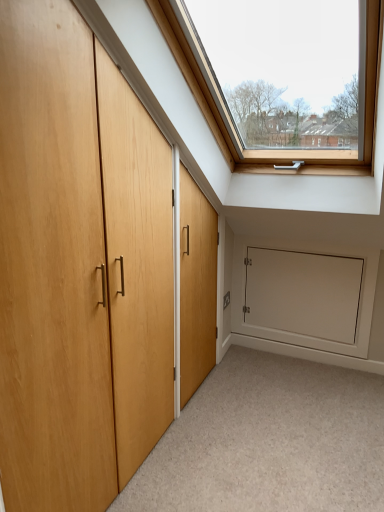
In order to click on light wood door at left in this screenshot , I will do `click(78, 266)`.

Find the location of `white matte door at lower right`. white matte door at lower right is located at coordinates (303, 293).

In the scene shown: Considering the sizes of white matte door at lower right and carpeted floor at lower center in the image, is white matte door at lower right wider or thinner than carpeted floor at lower center?

white matte door at lower right is thinner than carpeted floor at lower center.

Locate an element on the screen. screen door that is above the carpeted floor at lower center (from the image's perspective) is located at coordinates (303, 293).

Which of these two, white matte door at lower right or carpeted floor at lower center, is bigger?

With larger size is carpeted floor at lower center.

Which of these two, white matte door at lower right or light wood door at left, stands taller?

With more height is light wood door at left.

The width and height of the screenshot is (384, 512). Find the location of `screen door that appears on the right of light wood door at left`. screen door that appears on the right of light wood door at left is located at coordinates (303, 293).

Is white matte door at lower right oriented away from light wood door at left?

white matte door at lower right is not turned away from light wood door at left.

Is white matte door at lower right situated inside light wood door at left or outside?

white matte door at lower right lies outside light wood door at left.

How far apart are light wood door at left and white matte door at lower right?

The distance of light wood door at left from white matte door at lower right is 5.07 feet.

From the image's perspective, between light wood door at left and white matte door at lower right, which one is located above?

From the image's view, light wood door at left is above.

Does point (13, 468) appear closer or farther from the camera than point (279, 279)?

Point (13, 468) appears to be closer to the viewer than point (279, 279).

Is the depth of light wood door at left less than that of white matte door at lower right?

Yes, it is in front of white matte door at lower right.

Considering the positions of point (203, 485) and point (270, 326), is point (203, 485) closer or farther from the camera than point (270, 326)?

Clearly, point (203, 485) is closer to the camera than point (270, 326).

From the image's perspective, would you say carpeted floor at lower center is positioned over white matte door at lower right?

No, from the image's perspective, carpeted floor at lower center is not on top of white matte door at lower right.

From the picture: Can you tell me how much carpeted floor at lower center and white matte door at lower right differ in facing direction?

carpeted floor at lower center and white matte door at lower right are facing 89.4 degrees away from each other.

Does carpeted floor at lower center have a smaller size compared to white matte door at lower right?

No, carpeted floor at lower center is not smaller than white matte door at lower right.

From the image's perspective, is light wood door at left under carpeted floor at lower center?

No, from the image's perspective, light wood door at left is not beneath carpeted floor at lower center.

Is light wood door at left facing towards carpeted floor at lower center?

Yes, light wood door at left is turned towards carpeted floor at lower center.

From a real-world perspective, does light wood door at left stand above carpeted floor at lower center?

Yes.

Would you say light wood door at left contains carpeted floor at lower center?

No, carpeted floor at lower center is located outside of light wood door at left.

Is carpeted floor at lower center oriented away from light wood door at left?

carpeted floor at lower center is not turned away from light wood door at left.

Is carpeted floor at lower center positioned far away from light wood door at left?

carpeted floor at lower center is actually quite close to light wood door at left.

In terms of width, does carpeted floor at lower center look wider or thinner when compared to light wood door at left?

In the image, carpeted floor at lower center appears to be wider than light wood door at left.

Which object is further away from the camera, carpeted floor at lower center or light wood door at left?

carpeted floor at lower center is further from the camera.

Identify the location of corridor located underneath the white matte door at lower right (from a real-world perspective). This screenshot has width=384, height=512. (269, 441).

The image size is (384, 512). I want to click on screen door on the right of light wood door at left, so click(x=303, y=293).

Looking at the image, which one is located further to light wood door at left, carpeted floor at lower center or white matte door at lower right?

white matte door at lower right is positioned further to the anchor light wood door at left.

Estimate the real-world distances between objects in this image. Which object is further from carpeted floor at lower center, white matte door at lower right or light wood door at left?

light wood door at left.

Based on their spatial positions, is white matte door at lower right or carpeted floor at lower center closer to light wood door at left?

Among the two, carpeted floor at lower center is located nearer to light wood door at left.

From the image, which object appears to be farther from white matte door at lower right, carpeted floor at lower center or light wood door at left?

Based on the image, light wood door at left appears to be further to white matte door at lower right.

Considering their positions, is light wood door at left positioned closer to white matte door at lower right than carpeted floor at lower center?

carpeted floor at lower center lies closer to white matte door at lower right than the other object.

Considering their positions, is light wood door at left positioned further to carpeted floor at lower center than white matte door at lower right?

light wood door at left is positioned further to the anchor carpeted floor at lower center.

At what (x,y) coordinates should I click in order to perform the action: click on corridor between light wood door at left and white matte door at lower right along the z-axis. Please return your answer as a coordinate pair (x, y). Looking at the image, I should click on (269, 441).